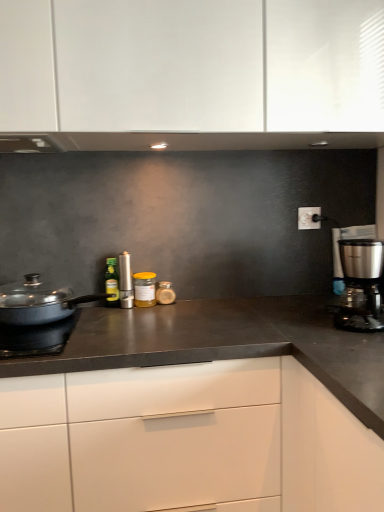
Image resolution: width=384 pixels, height=512 pixels. Identify the location of vacant area located to the right-hand side of satin silver canister at center, the fourth kitchen appliance positioned from the back. (173, 310).